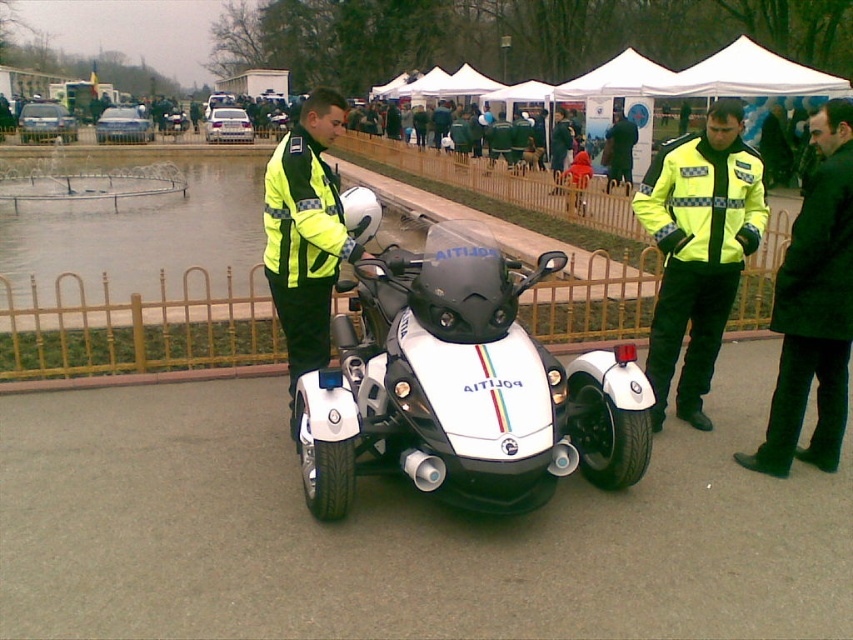
How far apart are white glossy trike at center and brushed metal water at left?

white glossy trike at center is 8.20 meters away from brushed metal water at left.

Which is behind, point (541, 397) or point (108, 170)?

Point (108, 170)

Is point (514, 342) closer to camera compared to point (107, 250)?

Yes, point (514, 342) is closer to viewer.

Image resolution: width=853 pixels, height=640 pixels. What are the coordinates of `white glossy trike at center` in the screenshot? It's located at pyautogui.click(x=462, y=387).

In the scene shown: Is yellow reflective jacket at center below green fabric jacket at center?

Indeed, yellow reflective jacket at center is positioned under green fabric jacket at center.

Is point (727, 179) positioned behind point (607, 140)?

No, it is in front of (607, 140).

Who is more distant from viewer, (695, 241) or (630, 128)?

The point (630, 128) is behind.

Locate an element on the screen. Image resolution: width=853 pixels, height=640 pixels. yellow reflective jacket at center is located at coordinates (698, 250).

Can you confirm if white glossy trike at center is wider than black leather jacket at right?

Correct, the width of white glossy trike at center exceeds that of black leather jacket at right.

Which of these two, white glossy trike at center or black leather jacket at right, stands taller?

black leather jacket at right is taller.

At what (x,y) coordinates should I click in order to perform the action: click on white glossy trike at center. Please return your answer as a coordinate pair (x, y). The image size is (853, 640). Looking at the image, I should click on (462, 387).